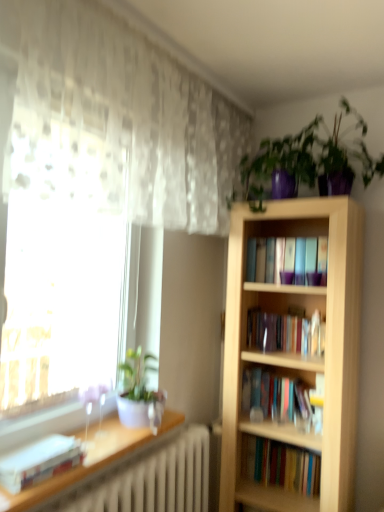
Question: Is white glossy pot at left, marked as the 1th houseplant in a bottom-to-top arrangement, in front of or behind translucent fabric at left in the image?

Choices:
 (A) behind
 (B) front

Answer: (A)

Question: From the image's perspective, is white glossy pot at left, marked as the 2th houseplant in a right-to-left arrangement, above or below translucent fabric at left?

Choices:
 (A) above
 (B) below

Answer: (B)

Question: Which of these objects is positioned closest to the shiny purple pot at upper right, which is counted as the 2th houseplant, starting from the bottom?

Choices:
 (A) light wood bookcase at right
 (B) translucent fabric at left
 (C) white glossy shelf at lower left
 (D) white matte book at lower left
 (E) white glossy pot at left, marked as the 2th houseplant in a top-to-bottom arrangement

Answer: (A)

Question: Considering the real-world distances, which object is closest to the white matte book at lower left?

Choices:
 (A) translucent fabric at left
 (B) shiny purple pot at upper right, the second houseplant positioned from the left
 (C) white glossy pot at left, marked as the 2th houseplant in a right-to-left arrangement
 (D) white glossy shelf at lower left
 (E) light wood bookcase at right

Answer: (D)